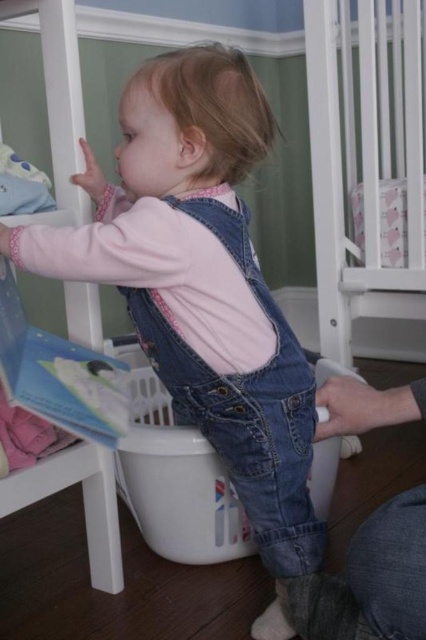
Is denim overalls at center wider than white plastic laundry basket at center?

Yes.

Is denim overalls at center further to the viewer compared to white plastic laundry basket at center?

No.

Which is in front, point (140, 136) or point (135, 486)?

Positioned in front is point (140, 136).

The image size is (426, 640). What are the coordinates of `denim overalls at center` in the screenshot? It's located at (201, 282).